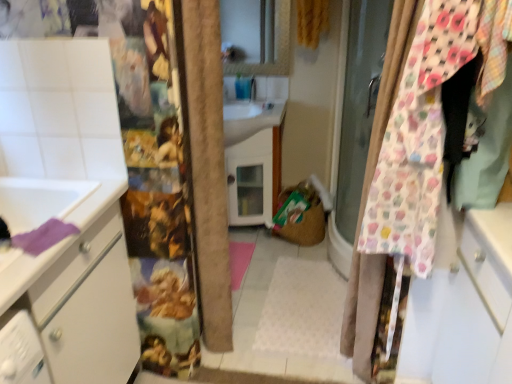
Question: Considering their positions, is white glossy sink at center located in front of or behind floral fabric curtain at right, placed as the first curtain when sorted from bottom to top?

Choices:
 (A) front
 (B) behind

Answer: (B)

Question: Is white glossy sink at center situated inside floral fabric curtain at right, the second curtain when ordered from back to front, or outside?

Choices:
 (A) inside
 (B) outside

Answer: (B)

Question: Considering the real-world distances, which object is closest to the yellow textured curtain at upper center, the 1th curtain when ordered from top to bottom?

Choices:
 (A) white glossy sink at center
 (B) floral fabric curtain at right, marked as the second curtain in a top-to-bottom arrangement

Answer: (A)

Question: Which object is the closest to the white glossy sink at center?

Choices:
 (A) floral fabric curtain at right, the second curtain when ordered from back to front
 (B) yellow textured curtain at upper center, the 1th curtain when ordered from top to bottom

Answer: (B)